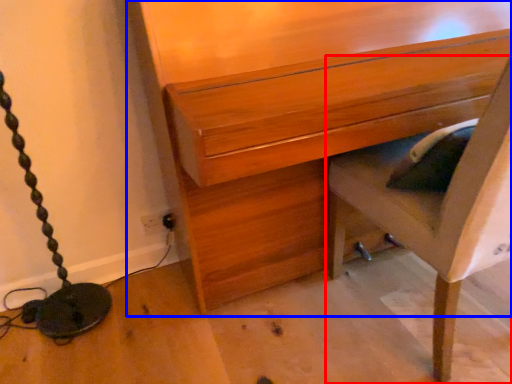
Question: Which object is further to the camera taking this photo, furniture (highlighted by a red box) or chest of drawers (highlighted by a blue box)?

Choices:
 (A) furniture
 (B) chest of drawers

Answer: (B)